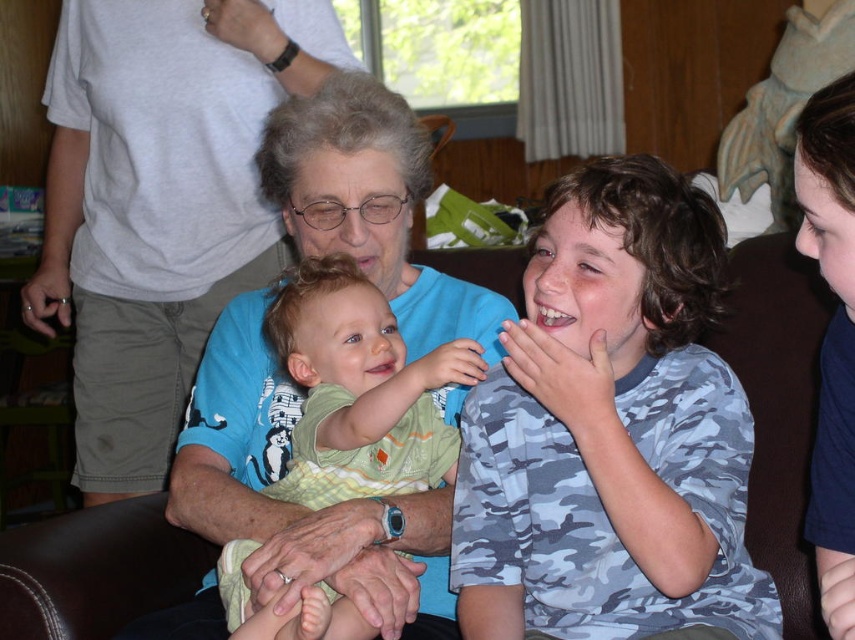
Question: Can you confirm if camouflage fabric shirt at center is smaller than light blue shirt at center?

Choices:
 (A) no
 (B) yes

Answer: (B)

Question: Is light blue shirt at center bigger than green cotton shirt at center?

Choices:
 (A) yes
 (B) no

Answer: (A)

Question: Considering the real-world distances, which object is farthest from the light blue shirt at center?

Choices:
 (A) camouflage fabric shirt at center
 (B) green cotton shirt at center

Answer: (A)

Question: Does light blue shirt at center have a larger size compared to green cotton shirt at center?

Choices:
 (A) yes
 (B) no

Answer: (A)

Question: Which of the following is the farthest from the observer?

Choices:
 (A) (323, 380)
 (B) (136, 381)
 (C) (510, 461)

Answer: (B)

Question: Based on their relative distances, which object is nearer to the green cotton shirt at center?

Choices:
 (A) camouflage fabric shirt at center
 (B) light blue shirt at center

Answer: (A)